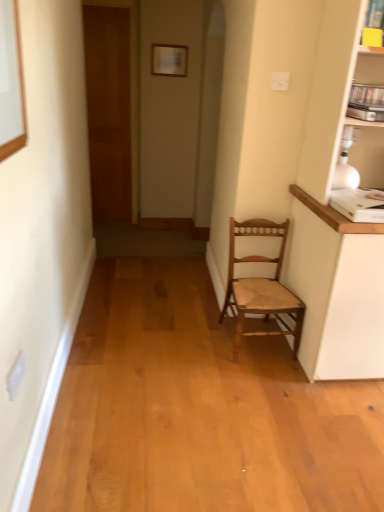
Find the location of a particular element. Image resolution: width=384 pixels, height=512 pixels. free spot above wooden door at left (from a real-world perspective) is located at coordinates (104, 1).